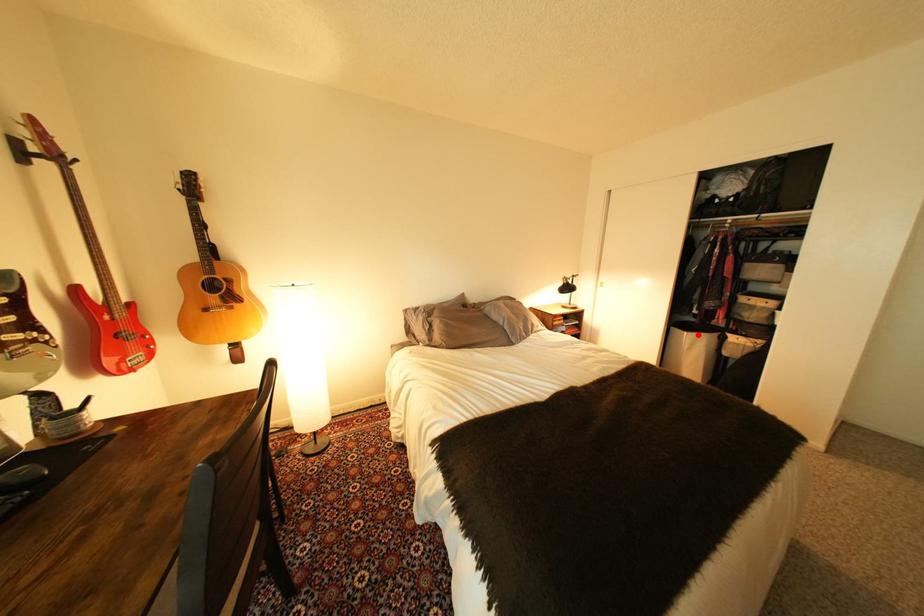
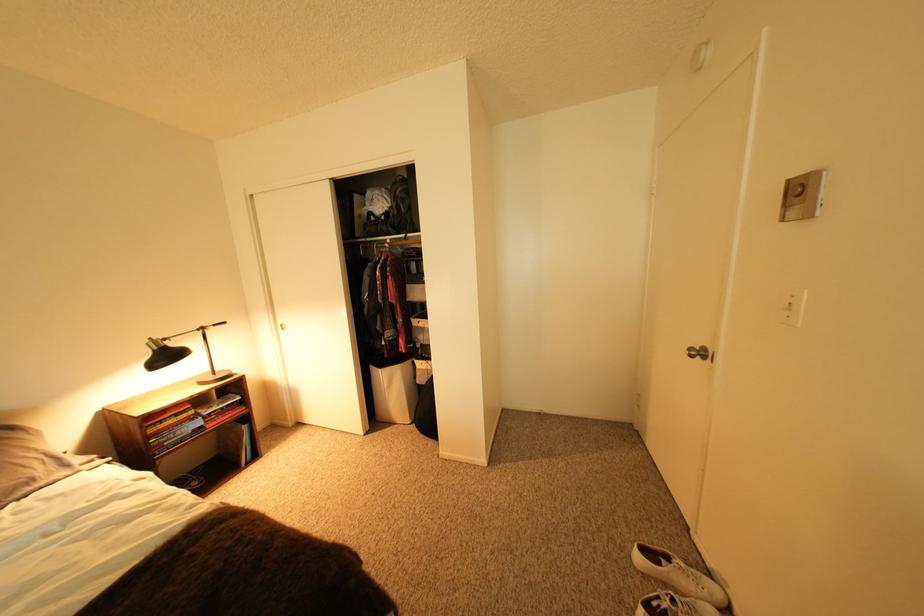
In the second image, find the point that corresponds to the highlighted location in the first image.

(393, 371)